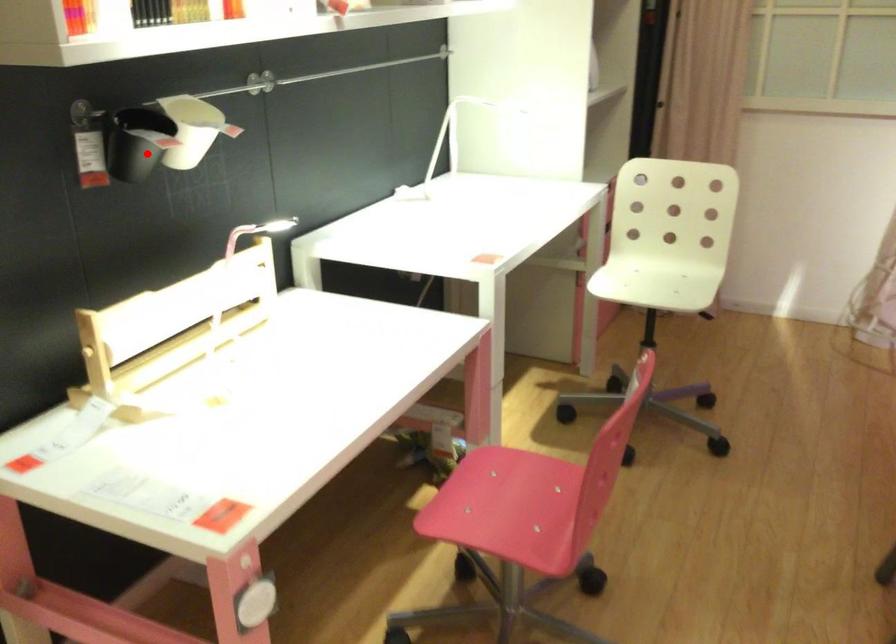
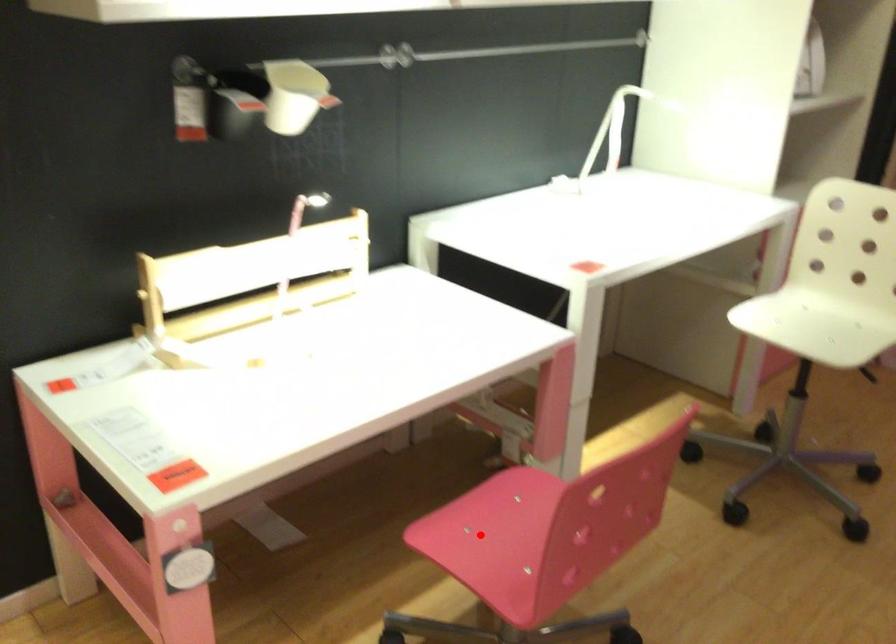
I am providing you with two images of the same scene from different viewpoints. A red point is marked on the first image and another point is marked on the second image. Is the marked point in image1 the same physical position as the marked point in image2?

No